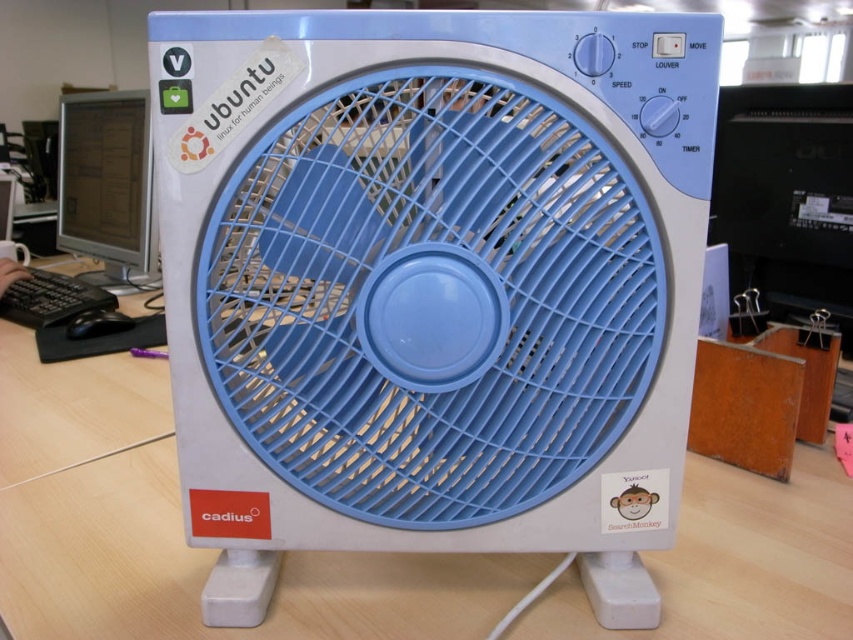
Question: Which point appears closest to the camera in this image?

Choices:
 (A) (364, 584)
 (B) (575, 472)

Answer: (B)

Question: Does blue plastic fan at center have a greater width compared to matte black monitor at left?

Choices:
 (A) no
 (B) yes

Answer: (B)

Question: Which point is farther from the camera taking this photo?

Choices:
 (A) pyautogui.click(x=90, y=132)
 (B) pyautogui.click(x=180, y=132)

Answer: (A)

Question: Among these objects, which one is nearest to the camera?

Choices:
 (A) blue plastic fan at center
 (B) white plastic computer desk at center

Answer: (A)

Question: Is blue plastic fan at center bigger than white plastic computer desk at center?

Choices:
 (A) no
 (B) yes

Answer: (A)

Question: Does blue plastic fan at center appear on the right side of white plastic computer desk at center?

Choices:
 (A) no
 (B) yes

Answer: (B)